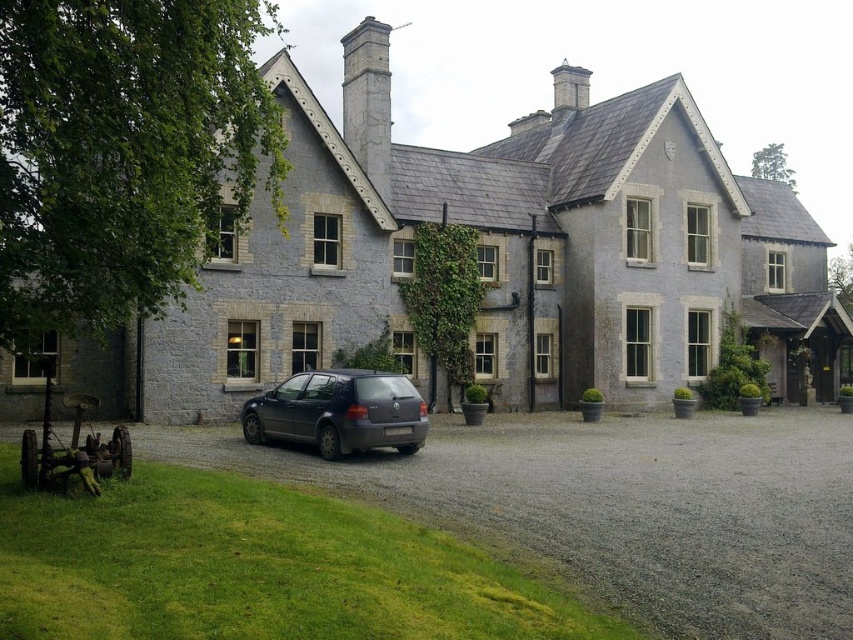
Question: Does gray gravel driveway at lower center appear on the left side of matte black car at center?

Choices:
 (A) no
 (B) yes

Answer: (A)

Question: In this image, where is gray gravel driveway at lower center located relative to matte black car at center?

Choices:
 (A) left
 (B) right

Answer: (B)

Question: Which point is closer to the camera?

Choices:
 (A) (349, 429)
 (B) (727, 625)

Answer: (B)

Question: Is gray gravel driveway at lower center to the left of matte black car at center from the viewer's perspective?

Choices:
 (A) no
 (B) yes

Answer: (A)